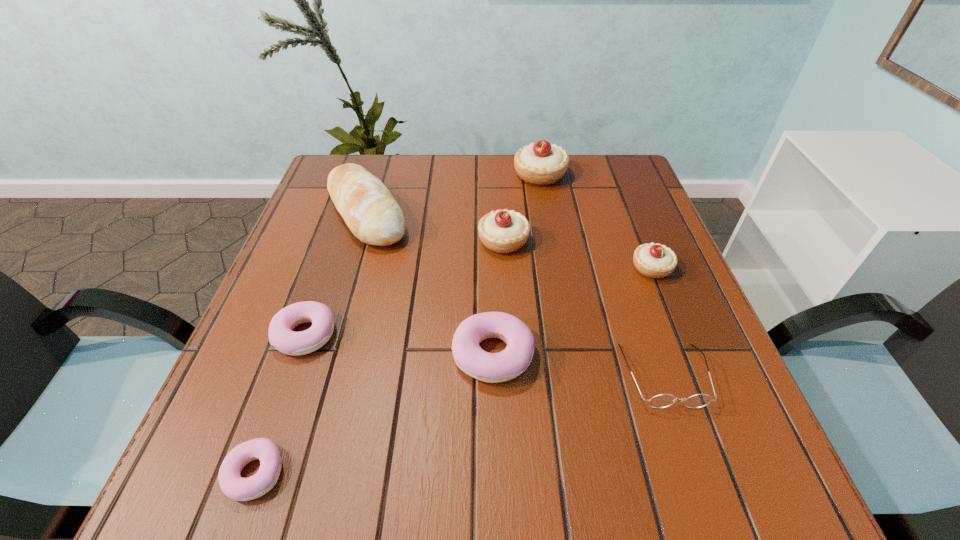
Where is `dark spectacles`? dark spectacles is located at coordinates (663, 400).

The width and height of the screenshot is (960, 540). Identify the location of the nearest object. (235, 487).

Find the location of a particular element. This screenshot has width=960, height=540. the shortest pastry is located at coordinates (235, 487).

Locate an element on the screen. vacant area situated 0.070m on the left of the farthest beige pastry is located at coordinates (489, 174).

Find the location of a particular element. vacant region located on the right of the bread is located at coordinates (470, 213).

Locate an element on the screen. This screenshot has height=540, width=960. vacant position located 0.240m on the front of the second smallest beige pastry is located at coordinates (510, 344).

Image resolution: width=960 pixels, height=540 pixels. I want to click on free location located 0.250m on the left of the smallest beige pastry, so click(x=518, y=268).

Locate an element on the screen. This screenshot has height=540, width=960. free space located 0.060m on the right of the fifth tallest object is located at coordinates click(566, 354).

I want to click on free space located on the back of the second shortest pastry, so click(351, 204).

Find the location of a particular element. The height and width of the screenshot is (540, 960). free space located through the lenses of the spectacles is located at coordinates (686, 439).